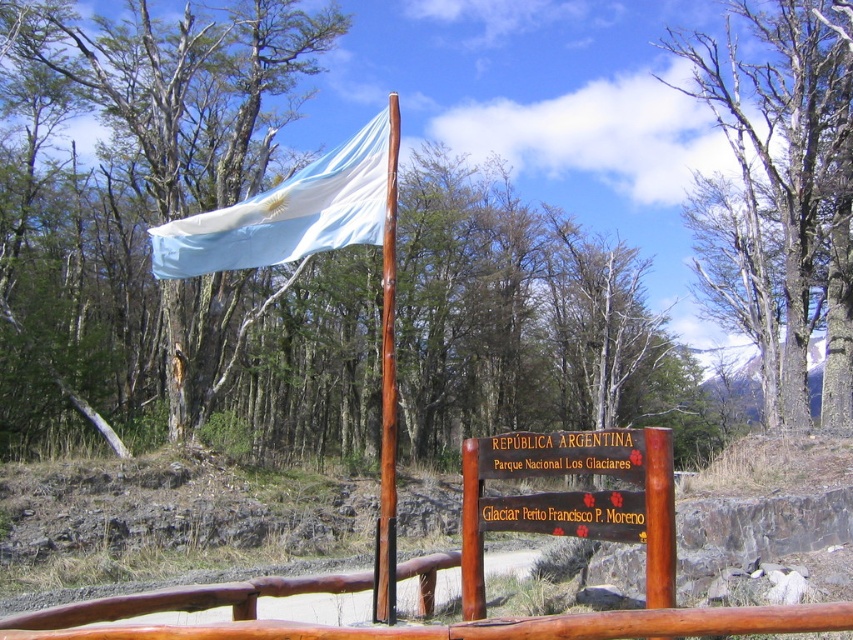
You are a tourist standing at the national park entrance and see the bare wood tree at upper center and the wooden sign at center. Which object is positioned higher in the scene?

The bare wood tree at upper center is positioned higher than the wooden sign at center in the scene.

You are a park ranger at the national park and need to determine which object is bigger between the bare wood tree at upper center and the white fabric flag at upper center. Which one is larger?

The bare wood tree at upper center is larger in size than the white fabric flag at upper center.